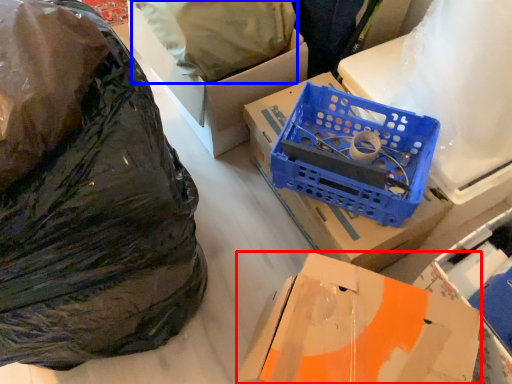
Question: Which object appears farthest to the camera in this image, box (highlighted by a red box) or wrapping paper (highlighted by a blue box)?

Choices:
 (A) box
 (B) wrapping paper

Answer: (B)